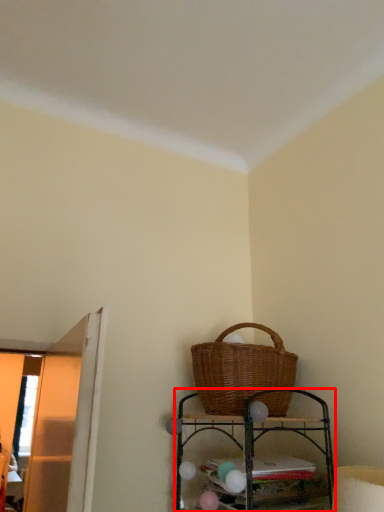
Question: Where is shelf (annotated by the red box) located in relation to picnic basket in the image?

Choices:
 (A) left
 (B) right

Answer: (A)